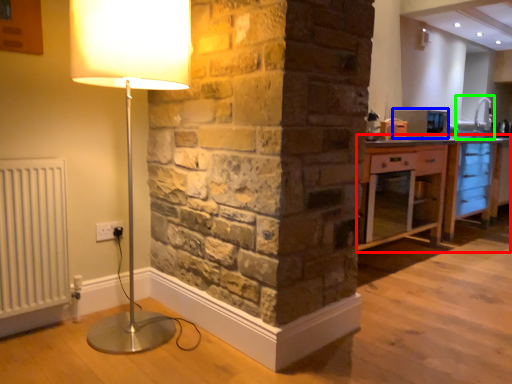
Question: Which is nearer to the cabinetry (highlighted by a red box)? appliance (highlighted by a blue box) or sink (highlighted by a green box).

Choices:
 (A) appliance
 (B) sink

Answer: (A)